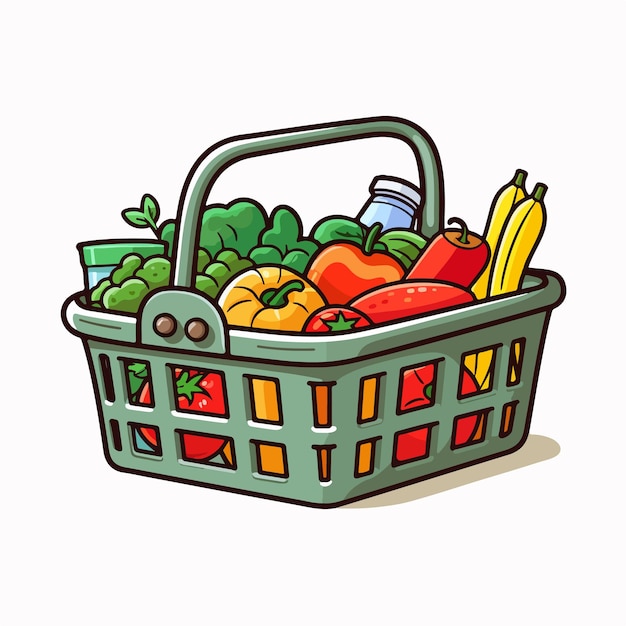
Locate an element on the screen. The image size is (626, 626). jar is located at coordinates (96, 264).